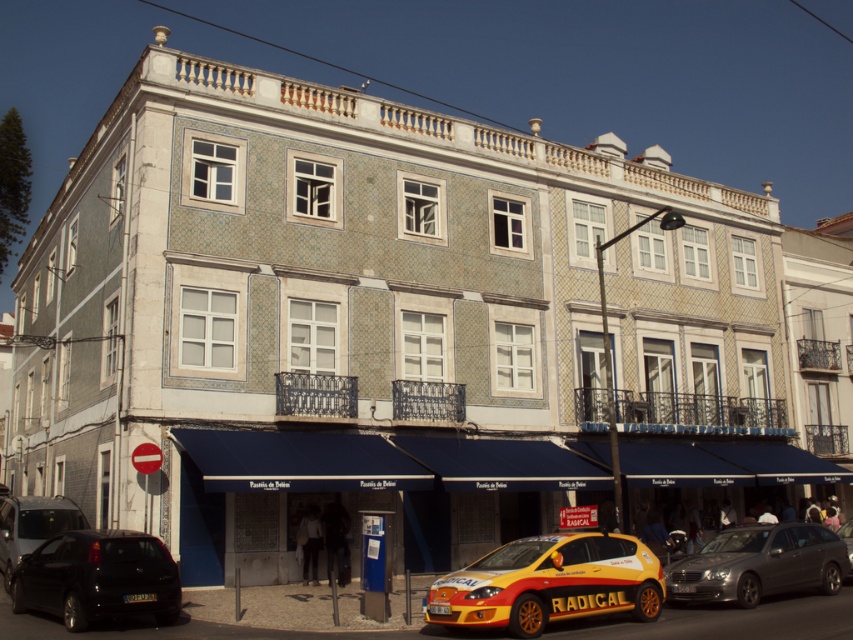
Who is more forward, (733, 592) or (68, 525)?

Positioned in front is point (733, 592).

Is metallic gray sedan at lower right positioned behind matte black van at lower left?

No, metallic gray sedan at lower right is closer to the viewer.

You are a GUI agent. You are given a task and a screenshot of the screen. Output one action in this format:
    pyautogui.click(x=<x>, y=<y>)
    Task: Click on the metallic gray sedan at lower right
    
    Given the screenshot: What is the action you would take?
    click(759, 564)

Can you confirm if black matte car at lower left is positioned above metallic gray sedan at lower right?

Yes.

Which is above, black matte car at lower left or metallic gray sedan at lower right?

black matte car at lower left is higher up.

Find the location of `black matte car at lower left`. black matte car at lower left is located at coordinates (96, 577).

Which is below, metallic gray sedan at lower right or yellow plastic license plate at center?

metallic gray sedan at lower right

Is metallic gray sedan at lower right to the left of yellow plastic license plate at center from the viewer's perspective?

In fact, metallic gray sedan at lower right is to the right of yellow plastic license plate at center.

Which is behind, point (770, 552) or point (444, 605)?

Point (770, 552)

Identify the location of metallic gray sedan at lower right. (759, 564).